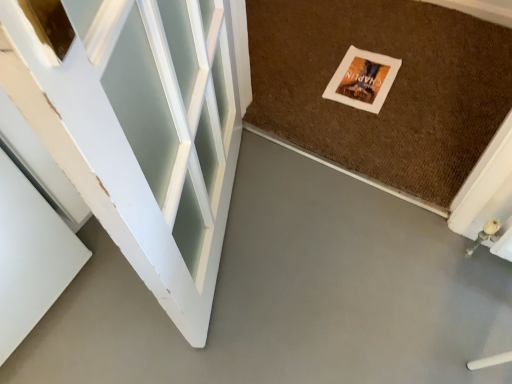
The image size is (512, 384). What do you see at coordinates (362, 80) in the screenshot?
I see `matte paper postcard at center` at bounding box center [362, 80].

At what (x,y) coordinates should I click in order to perform the action: click on gray smooth concrete at center. Please return your answer as a coordinate pair (x, y). This screenshot has height=384, width=512. Looking at the image, I should click on (290, 295).

Image resolution: width=512 pixels, height=384 pixels. What are the coordinates of `matte paper postcard at center` in the screenshot? It's located at pyautogui.click(x=362, y=80).

From the image's perspective, which is below, brown textured mat at center or matte paper postcard at center?

matte paper postcard at center.

Considering the relative sizes of brown textured mat at center and matte paper postcard at center in the image provided, is brown textured mat at center wider than matte paper postcard at center?

Correct, the width of brown textured mat at center exceeds that of matte paper postcard at center.

Is brown textured mat at center spatially inside matte paper postcard at center, or outside of it?

brown textured mat at center is located beyond the bounds of matte paper postcard at center.

Is brown textured mat at center positioned with its back to matte paper postcard at center?

brown textured mat at center does not have its back to matte paper postcard at center.

From a real-world perspective, is gray smooth concrete at center above or below matte paper postcard at center?

gray smooth concrete at center is below matte paper postcard at center.

Can you see gray smooth concrete at center touching matte paper postcard at center?

No, gray smooth concrete at center is not beside matte paper postcard at center.

From the image's perspective, which one is positioned higher, gray smooth concrete at center or matte paper postcard at center?

matte paper postcard at center, from the image's perspective.

Is matte paper postcard at center further to the viewer compared to gray smooth concrete at center?

Yes, matte paper postcard at center is behind gray smooth concrete at center.

What are the coordinates of `postcard above the gray smooth concrete at center (from a real-world perspective)` in the screenshot? It's located at 362,80.

Is matte paper postcard at center to the right of gray smooth concrete at center from the viewer's perspective?

Indeed, matte paper postcard at center is positioned on the right side of gray smooth concrete at center.

Measure the distance between matte paper postcard at center and gray smooth concrete at center.

matte paper postcard at center and gray smooth concrete at center are 24.87 inches apart.

Would you say brown textured mat at center is a long distance from gray smooth concrete at center?

No, there isn't a large distance between brown textured mat at center and gray smooth concrete at center.

Based on the photo, is brown textured mat at center bigger than gray smooth concrete at center?

Actually, brown textured mat at center might be smaller than gray smooth concrete at center.

In the image, is brown textured mat at center on the left side or the right side of gray smooth concrete at center?

brown textured mat at center is to the right of gray smooth concrete at center.

From a real-world perspective, does brown textured mat at center sit lower than gray smooth concrete at center?

No.

From a real-world perspective, is gray smooth concrete at center below brown textured mat at center?

Correct, in the physical world, gray smooth concrete at center is lower than brown textured mat at center.

Is point (500, 270) in front of point (486, 81)?

Yes, it is in front of point (486, 81).

From the image's perspective, is gray smooth concrete at center positioned above or below brown textured mat at center?

From the image's perspective, gray smooth concrete at center appears below brown textured mat at center.

Between matte paper postcard at center and brown textured mat at center, which one has larger size?

brown textured mat at center.

Does point (357, 85) lie behind point (490, 127)?

Yes, it is behind point (490, 127).

Is the depth of matte paper postcard at center less than that of brown textured mat at center?

No, the depth of matte paper postcard at center is greater than that of brown textured mat at center.

From a real-world perspective, is matte paper postcard at center physically above brown textured mat at center?

Yes, from a real-world perspective, matte paper postcard at center is over brown textured mat at center

The width and height of the screenshot is (512, 384). Identify the location of postcard located above the brown textured mat at center (from a real-world perspective). point(362,80).

The image size is (512, 384). Identify the location of concrete located on the left of matte paper postcard at center. (290, 295).

From the image, which object appears to be farther from gray smooth concrete at center, brown textured mat at center or matte paper postcard at center?

matte paper postcard at center is further to gray smooth concrete at center.

Which object lies further to the anchor point brown textured mat at center, gray smooth concrete at center or matte paper postcard at center?

gray smooth concrete at center is further to brown textured mat at center.

Which object lies nearer to the anchor point gray smooth concrete at center, matte paper postcard at center or brown textured mat at center?

Based on the image, brown textured mat at center appears to be nearer to gray smooth concrete at center.

Which object lies nearer to the anchor point brown textured mat at center, matte paper postcard at center or gray smooth concrete at center?

matte paper postcard at center.

Looking at the image, which one is located further to matte paper postcard at center, gray smooth concrete at center or brown textured mat at center?

The object further to matte paper postcard at center is gray smooth concrete at center.

Considering their positions, is brown textured mat at center positioned closer to matte paper postcard at center than gray smooth concrete at center?

Based on the image, brown textured mat at center appears to be nearer to matte paper postcard at center.

Find the location of a particular element. postcard between brown textured mat at center and gray smooth concrete at center in the up-down direction is located at coordinates [x=362, y=80].